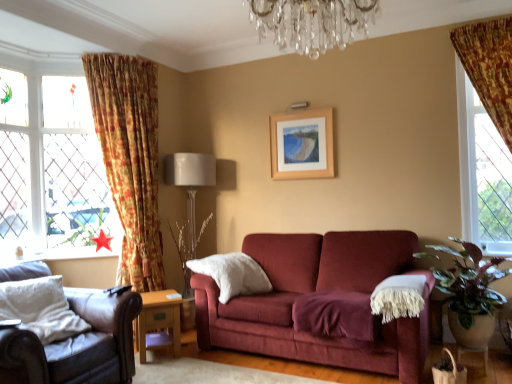
Question: Does green leafy plant at right appear on the right side of wooden picture frame at upper center?

Choices:
 (A) no
 (B) yes

Answer: (B)

Question: Does green leafy plant at right come in front of wooden picture frame at upper center?

Choices:
 (A) yes
 (B) no

Answer: (A)

Question: Can you confirm if green leafy plant at right is bigger than wooden picture frame at upper center?

Choices:
 (A) no
 (B) yes

Answer: (B)

Question: Is green leafy plant at right placed right next to wooden picture frame at upper center?

Choices:
 (A) yes
 (B) no

Answer: (B)

Question: Considering the relative sizes of green leafy plant at right and wooden picture frame at upper center in the image provided, is green leafy plant at right thinner than wooden picture frame at upper center?

Choices:
 (A) no
 (B) yes

Answer: (A)

Question: From the image's perspective, is leather armchair at lower left above or below white fabric lampshade at center?

Choices:
 (A) below
 (B) above

Answer: (A)

Question: In the image, is leather armchair at lower left positioned in front of or behind white fabric lampshade at center?

Choices:
 (A) behind
 (B) front

Answer: (B)

Question: Is leather armchair at lower left wider or thinner than white fabric lampshade at center?

Choices:
 (A) wide
 (B) thin

Answer: (A)

Question: From a real-world perspective, is leather armchair at lower left physically located above or below white fabric lampshade at center?

Choices:
 (A) below
 (B) above

Answer: (A)

Question: Considering the positions of floral fabric curtain at left and clear glass window at left in the image, is floral fabric curtain at left bigger or smaller than clear glass window at left?

Choices:
 (A) small
 (B) big

Answer: (B)

Question: Is floral fabric curtain at left inside the boundaries of clear glass window at left, or outside?

Choices:
 (A) inside
 (B) outside

Answer: (B)

Question: Considering their positions, is floral fabric curtain at left located in front of or behind clear glass window at left?

Choices:
 (A) behind
 (B) front

Answer: (B)

Question: Based on their positions, is floral fabric curtain at left located to the left or right of clear glass window at left?

Choices:
 (A) left
 (B) right

Answer: (B)

Question: Considering the positions of leather armchair at lower left and red paper star at lower left in the image, is leather armchair at lower left bigger or smaller than red paper star at lower left?

Choices:
 (A) big
 (B) small

Answer: (A)

Question: Would you say leather armchair at lower left is inside or outside red paper star at lower left?

Choices:
 (A) inside
 (B) outside

Answer: (B)